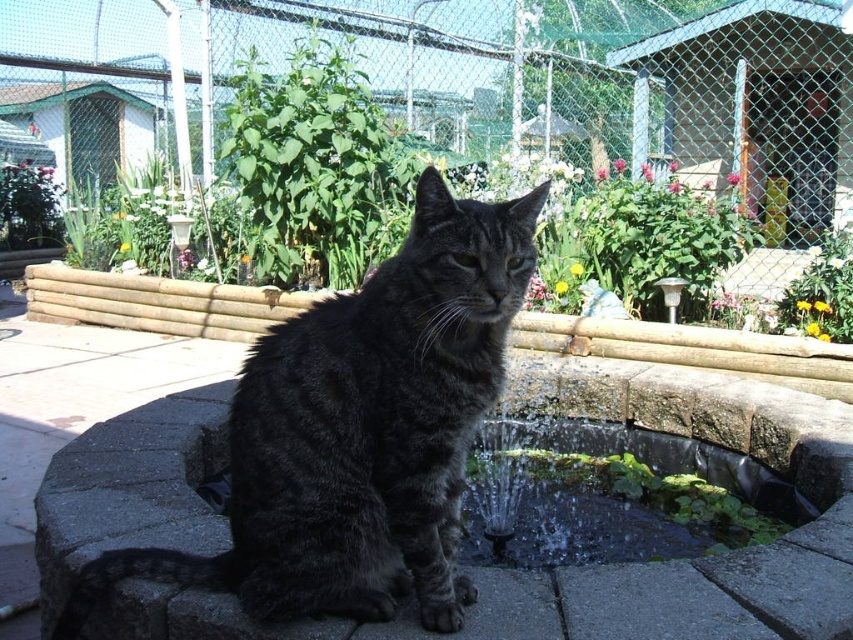
Find the location of a particular element. The width and height of the screenshot is (853, 640). dark gray fur cat at center is located at coordinates (361, 432).

Looking at this image, can you confirm if dark gray fur cat at center is shorter than smooth stone fountain at center?

Incorrect, dark gray fur cat at center's height does not fall short of smooth stone fountain at center's.

Does point (320, 454) come farther from viewer compared to point (683, 588)?

No, it is not.

The height and width of the screenshot is (640, 853). I want to click on dark gray fur cat at center, so tap(361, 432).